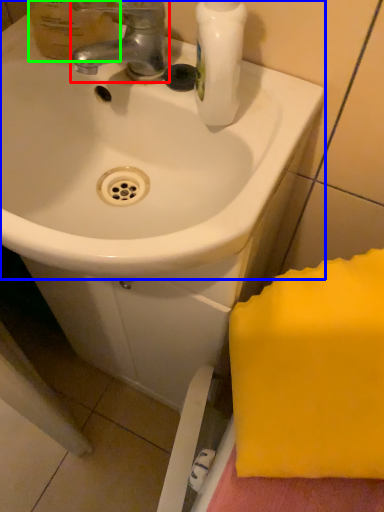
Question: Estimate the real-world distances between objects in this image. Which object is closer to tap (highlighted by a red box), sink (highlighted by a blue box) or mouthwash (highlighted by a green box)?

Choices:
 (A) sink
 (B) mouthwash

Answer: (B)